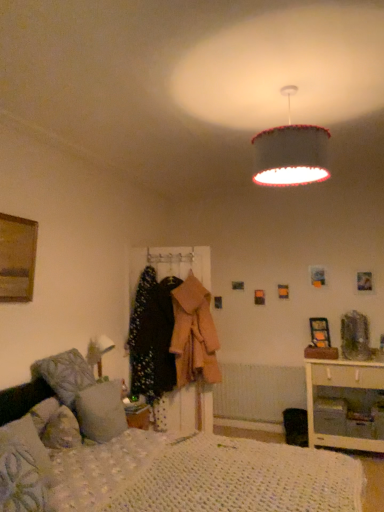
The image size is (384, 512). In order to click on empty space that is ontop of textured fabric lampshade at upper center (from a real-world perspective) in this screenshot , I will do `click(284, 90)`.